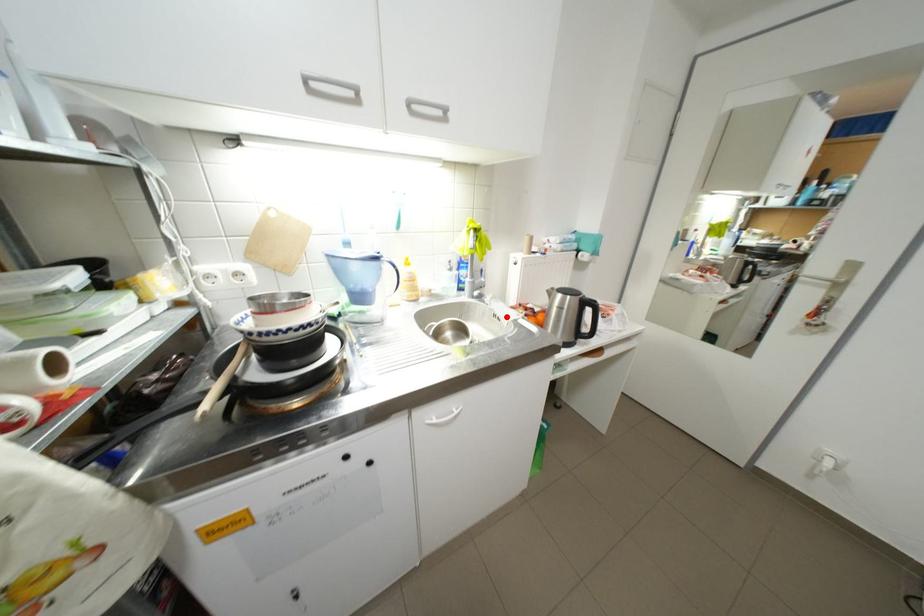
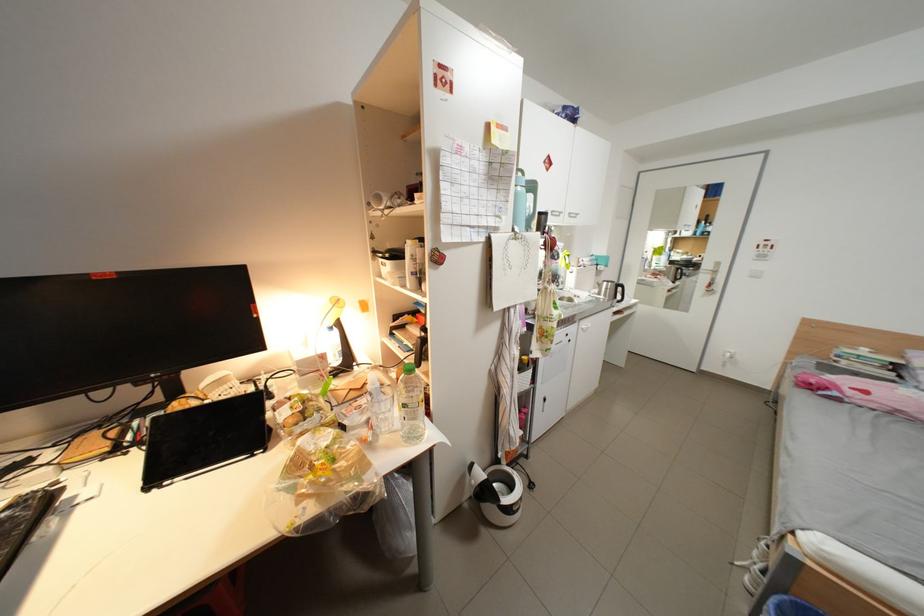
Locate, in the second image, the point that corresponds to the highlighted location in the first image.

(587, 297)